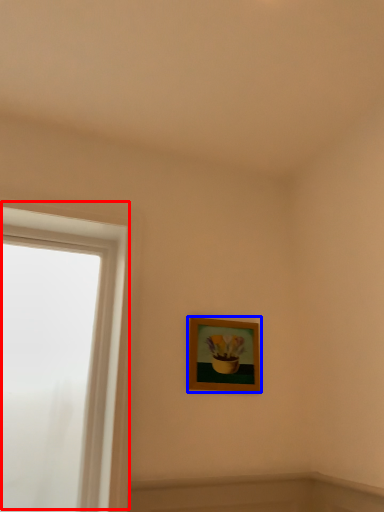
Question: Which object is closer to the camera taking this photo, window (highlighted by a red box) or picture frame (highlighted by a blue box)?

Choices:
 (A) window
 (B) picture frame

Answer: (A)